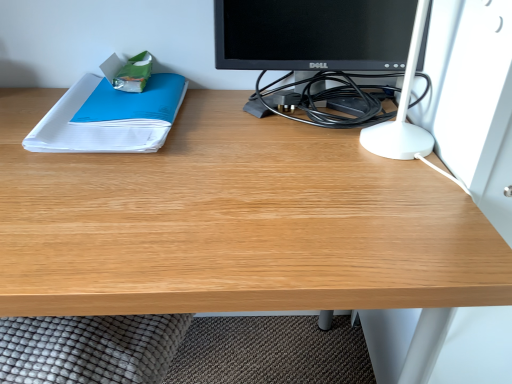
Where is `free location to the right of white paper at left`? free location to the right of white paper at left is located at coordinates (241, 135).